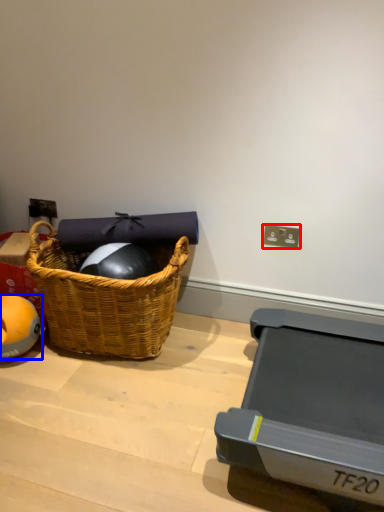
Question: Which point is further to the camera, electric outlet (highlighted by a red box) or ball (highlighted by a blue box)?

Choices:
 (A) electric outlet
 (B) ball

Answer: (A)